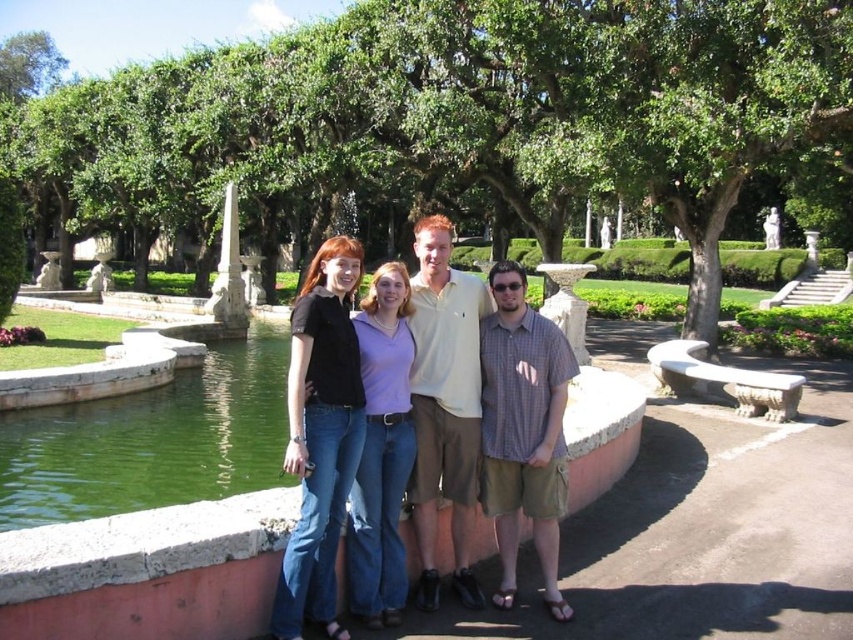
You are a photographer trying to capture a photo of the denim jeans at center and the matte black shirt at center. Which one is located to the left of the other?

The denim jeans at center is positioned on the left side of matte black shirt at center.

You are a photographer trying to capture a group photo in the garden. You notice the green liquid water at lower left and the light beige polo shirt at center. Which object takes up more horizontal space in the photo?

The green liquid water at lower left takes up more horizontal space in the photo because its width is larger than that of the light beige polo shirt at center.

You are a photographer trying to capture a group photo of the matte black shirt at center and the checkered fabric shirt at center. Since you want both shirts to appear equally sized in the photo, which person should move closer to the camera?

The matte black shirt at center should move closer to the camera because its width is larger than the checkered fabric shirt at center. By moving closer, its apparent size will reduce to match the smaller checkered fabric shirt at center.